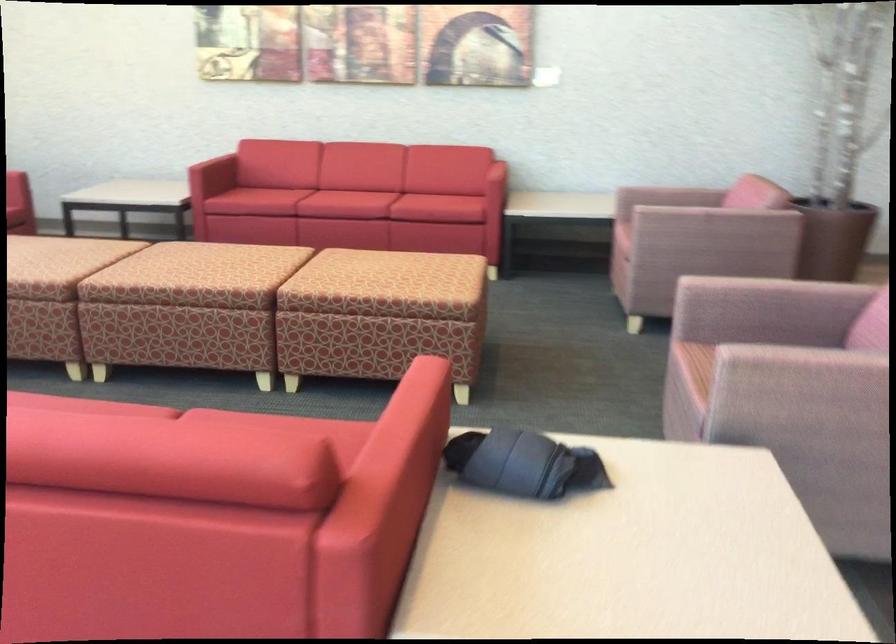
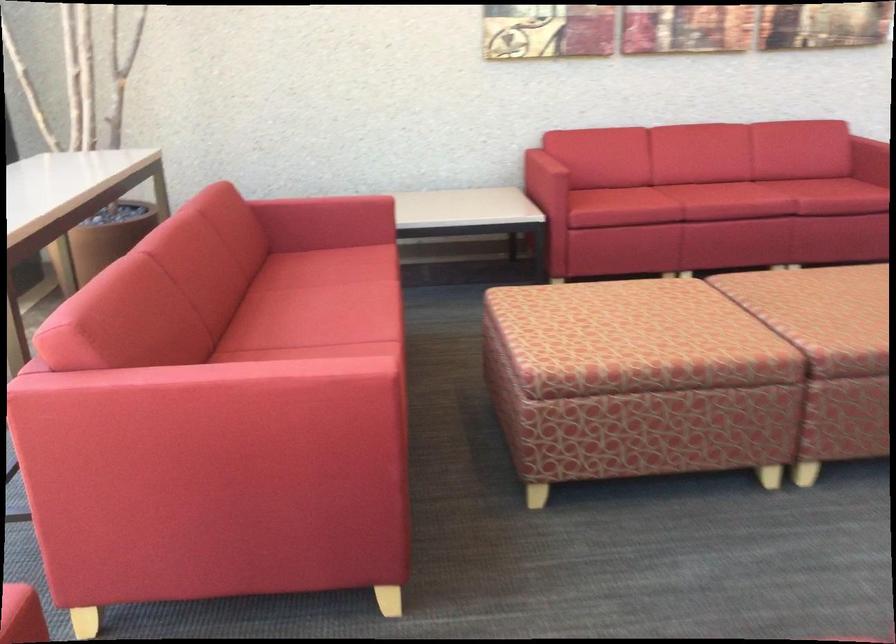
In the second image, find the point that corresponds to [154,257] in the first image.

(834, 317)